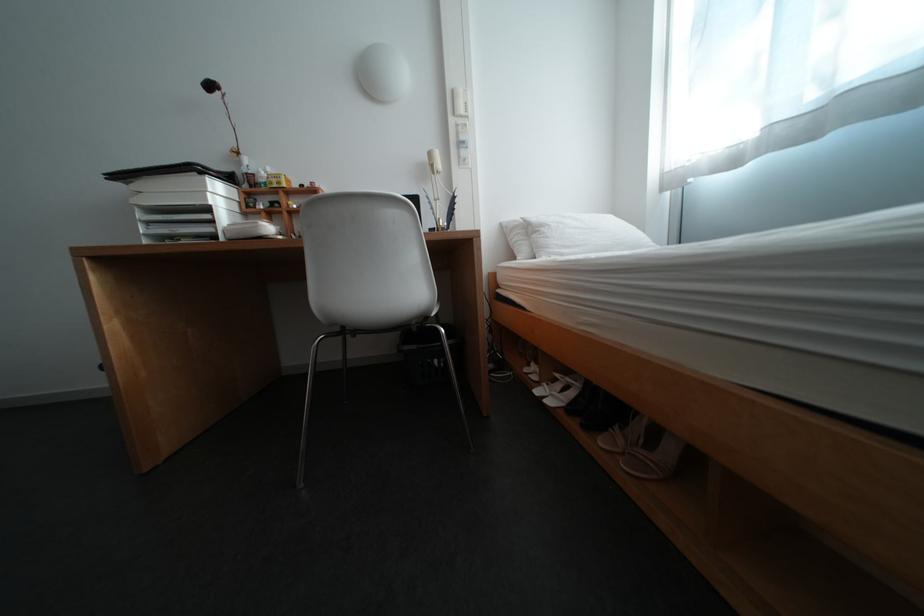
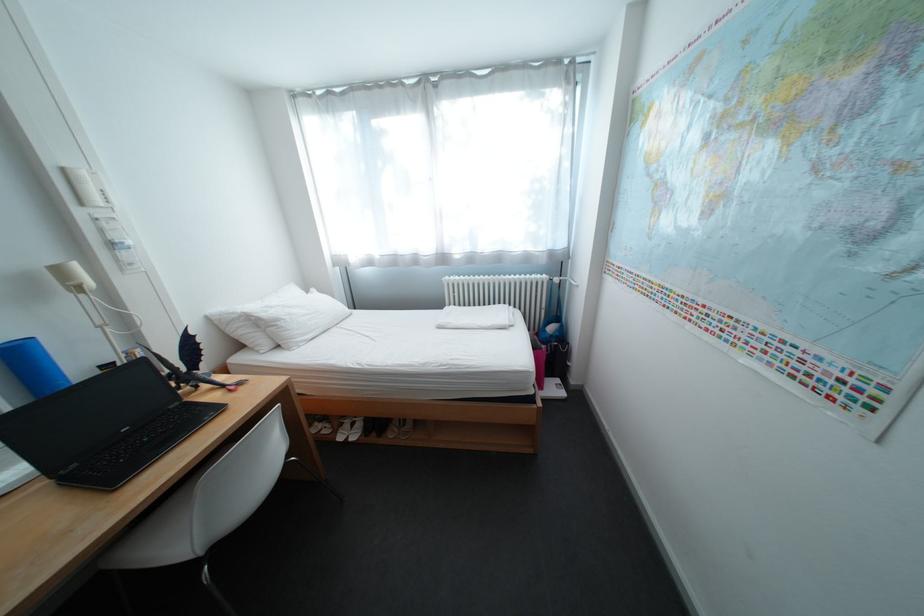
Where in the second image is the point corresponding to point 466,92 from the first image?

(76, 171)